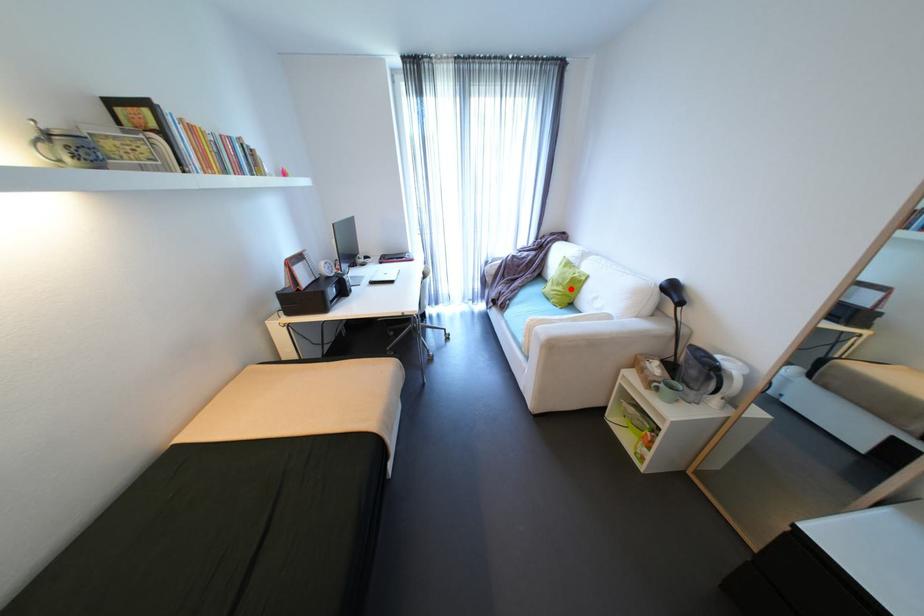
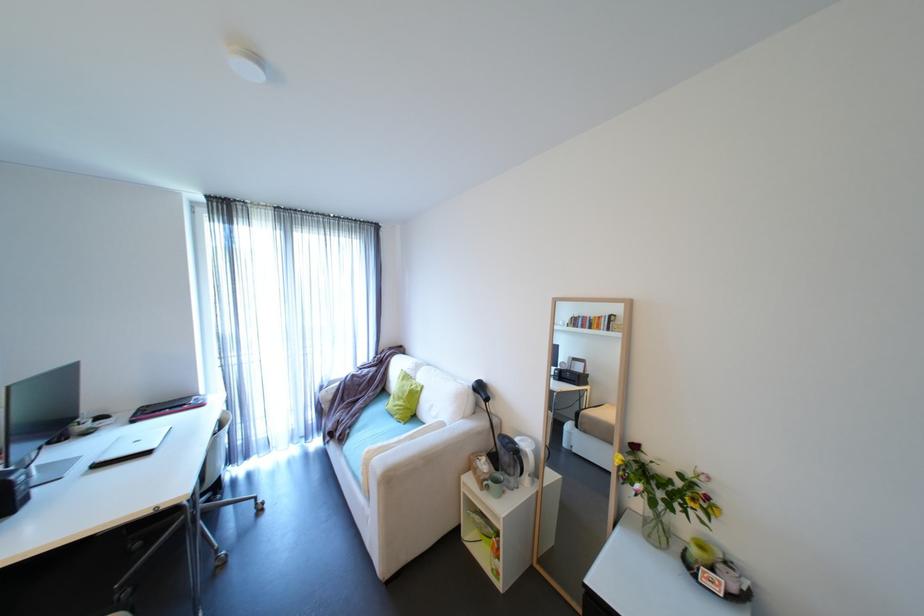
Question: I am providing you with two images of the same scene from different viewpoints. A red point is marked on the first image. Can you still see the location of the red point in image 2?

Choices:
 (A) Yes
 (B) No

Answer: (A)